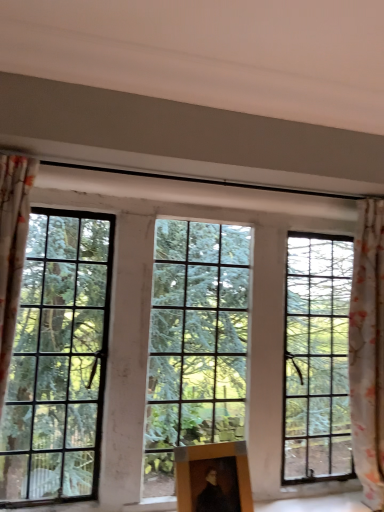
Question: Can we say wooden picture frame at center lies outside floral fabric curtain at right?

Choices:
 (A) no
 (B) yes

Answer: (B)

Question: Could you tell me if wooden picture frame at center is turned towards floral fabric curtain at right?

Choices:
 (A) yes
 (B) no

Answer: (B)

Question: Considering the relative positions of wooden picture frame at center and floral fabric curtain at right in the image provided, is wooden picture frame at center in front of floral fabric curtain at right?

Choices:
 (A) no
 (B) yes

Answer: (B)

Question: Can you confirm if wooden picture frame at center is thinner than floral fabric curtain at right?

Choices:
 (A) no
 (B) yes

Answer: (B)

Question: Is wooden picture frame at center to the left of floral fabric curtain at right from the viewer's perspective?

Choices:
 (A) yes
 (B) no

Answer: (A)

Question: Considering the relative sizes of wooden picture frame at center and floral fabric curtain at right in the image provided, is wooden picture frame at center wider than floral fabric curtain at right?

Choices:
 (A) yes
 (B) no

Answer: (B)

Question: From a real-world perspective, is clear glass window at center on wooden picture frame at center?

Choices:
 (A) yes
 (B) no

Answer: (A)

Question: Considering the relative positions of clear glass window at center and wooden picture frame at center in the image provided, is clear glass window at center to the right of wooden picture frame at center from the viewer's perspective?

Choices:
 (A) no
 (B) yes

Answer: (A)

Question: Is clear glass window at center behind wooden picture frame at center?

Choices:
 (A) yes
 (B) no

Answer: (A)

Question: Does clear glass window at center have a greater width compared to wooden picture frame at center?

Choices:
 (A) yes
 (B) no

Answer: (B)

Question: Is clear glass window at center thinner than wooden picture frame at center?

Choices:
 (A) yes
 (B) no

Answer: (A)

Question: From the image's perspective, is clear glass window at center located above wooden picture frame at center?

Choices:
 (A) yes
 (B) no

Answer: (A)

Question: Can you confirm if floral fabric curtain at right is taller than clear glass window at center?

Choices:
 (A) no
 (B) yes

Answer: (B)